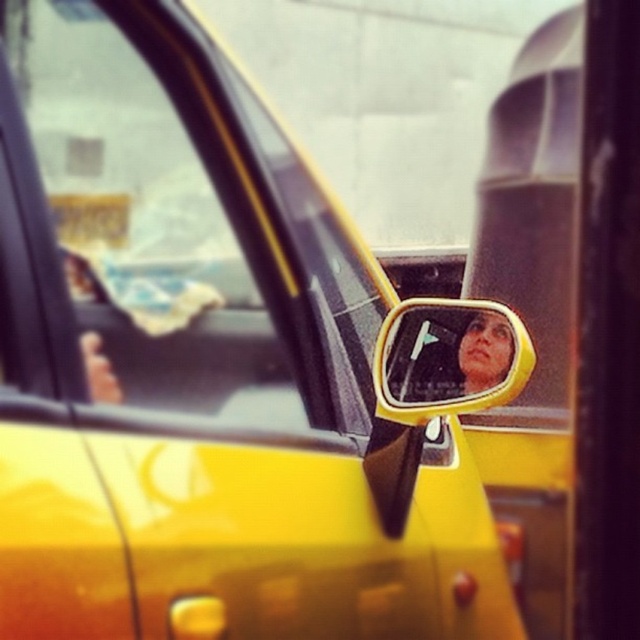
Is the position of transparent glass car window at upper left more distant than that of yellow plastic mirror at center?

That is False.

Between transparent glass car window at upper left and yellow plastic mirror at center, which one is positioned lower?

yellow plastic mirror at center is below.

Does point (99, 337) lie in front of point (502, 381)?

Yes, it is.

Where is `transparent glass car window at upper left`? This screenshot has width=640, height=640. transparent glass car window at upper left is located at coordinates (145, 218).